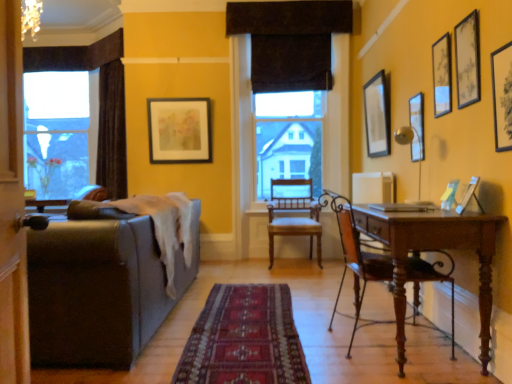
Question: Is matte black picture frame at upper right, which is the 5th picture frame from back to front, shorter than matte black picture frame at upper center, which is the 7th picture frame from right to left?

Choices:
 (A) no
 (B) yes

Answer: (B)

Question: From the image's perspective, is matte black picture frame at upper right, which appears as the fourth picture frame when viewed from the left, located beneath matte black picture frame at upper center, which is the 7th picture frame from right to left?

Choices:
 (A) no
 (B) yes

Answer: (A)

Question: Is matte black picture frame at upper right, which is the 5th picture frame from back to front, surrounding matte black picture frame at upper center, the 1th picture frame from the left?

Choices:
 (A) yes
 (B) no

Answer: (B)

Question: From a real-world perspective, is matte black picture frame at upper right, which appears as the fourth picture frame when viewed from the left, located higher than matte black picture frame at upper center, which is the 7th picture frame from right to left?

Choices:
 (A) yes
 (B) no

Answer: (A)

Question: Can you confirm if matte black picture frame at upper right, which appears as the fourth picture frame when viewed from the left, is wider than matte black picture frame at upper center, arranged as the 7th picture frame when viewed from the front?

Choices:
 (A) no
 (B) yes

Answer: (A)

Question: From their relative heights in the image, would you say brown fabric curtain at upper center is taller or shorter than carpeted rug at center?

Choices:
 (A) tall
 (B) short

Answer: (A)

Question: Is brown fabric curtain at upper center inside the boundaries of carpeted rug at center, or outside?

Choices:
 (A) inside
 (B) outside

Answer: (B)

Question: In terms of size, does brown fabric curtain at upper center appear bigger or smaller than carpeted rug at center?

Choices:
 (A) big
 (B) small

Answer: (A)

Question: From a real-world perspective, is brown fabric curtain at upper center physically located above or below carpeted rug at center?

Choices:
 (A) below
 (B) above

Answer: (B)

Question: Considering the relative positions of matte black picture frame at upper right, placed as the fifth picture frame when sorted from front to back, and matte black picture frame at upper right, the second picture frame from the back, in the image provided, is matte black picture frame at upper right, placed as the fifth picture frame when sorted from front to back, to the left or to the right of matte black picture frame at upper right, the second picture frame from the back,?

Choices:
 (A) left
 (B) right

Answer: (B)

Question: From a real-world perspective, is matte black picture frame at upper right, which is counted as the 3th picture frame, starting from the back, above or below matte black picture frame at upper right, which is counted as the fifth picture frame, starting from the left?

Choices:
 (A) above
 (B) below

Answer: (B)

Question: Looking at the image, does matte black picture frame at upper right, which is counted as the 3th picture frame, starting from the back, seem bigger or smaller compared to matte black picture frame at upper right, arranged as the third picture frame when viewed from the right?

Choices:
 (A) small
 (B) big

Answer: (A)

Question: From the image's perspective, is matte black picture frame at upper right, which is counted as the 3th picture frame, starting from the back, above or below matte black picture frame at upper right, the second picture frame from the back?

Choices:
 (A) above
 (B) below

Answer: (B)

Question: Would you say matte black picture frame at upper right, which is counted as the 3th picture frame, starting from the back, is inside or outside leather couch at left?

Choices:
 (A) inside
 (B) outside

Answer: (B)

Question: From the image's perspective, relative to leather couch at left, is matte black picture frame at upper right, the first picture frame positioned from the right, above or below?

Choices:
 (A) below
 (B) above

Answer: (B)